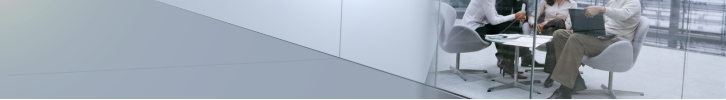
Identify the location of papers. (512, 34), (520, 39).